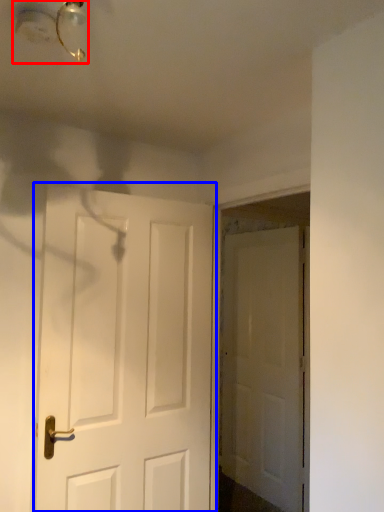
Question: Which point is further to the camera, light fixture (highlighted by a red box) or door (highlighted by a blue box)?

Choices:
 (A) light fixture
 (B) door

Answer: (B)